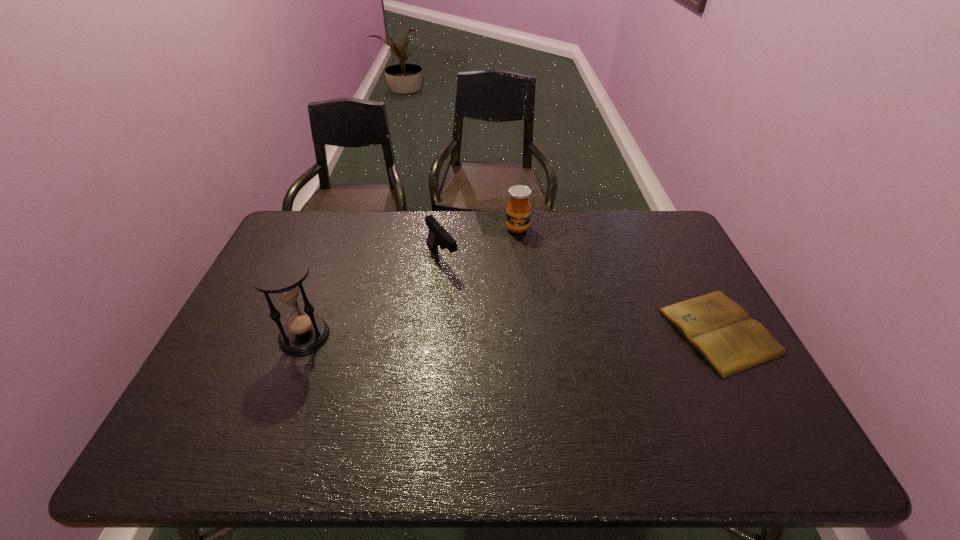
I want to click on empty location between the third object from left to right and the book, so click(x=618, y=280).

Identify the location of unoccupied area between the pistol and the book. The image size is (960, 540). (581, 294).

You are a GUI agent. You are given a task and a screenshot of the screen. Output one action in this format:
    pyautogui.click(x=<x>, y=<y>)
    Task: Click on the empty space between the tallest object and the third object from left to right
    
    Given the screenshot: What is the action you would take?
    pyautogui.click(x=411, y=282)

This screenshot has height=540, width=960. What are the coordinates of `free space that is in between the honey and the hourglass` in the screenshot? It's located at (411, 282).

The height and width of the screenshot is (540, 960). In order to click on vacant point located between the rightmost object and the third object from left to right in this screenshot , I will do `click(618, 280)`.

Locate which object is the third closest to the book. Please provide its 2D coordinates. Your answer should be formatted as a tuple, i.e. [(x, y)], where the tuple contains the x and y coordinates of a point satisfying the conditions above.

[(282, 275)]

Identify which object is located as the second nearest to the second farthest object. Please provide its 2D coordinates. Your answer should be formatted as a tuple, i.e. [(x, y)], where the tuple contains the x and y coordinates of a point satisfying the conditions above.

[(282, 275)]

Find the location of a particular element. The width and height of the screenshot is (960, 540). blank space that satisfies the following two spatial constraints: 1. on the front side of the second object from right to left; 2. on the left side of the book is located at coordinates (529, 330).

You are a GUI agent. You are given a task and a screenshot of the screen. Output one action in this format:
    pyautogui.click(x=<x>, y=<y>)
    Task: Click on the vacant region that satisfies the following two spatial constraints: 1. on the back side of the honey; 2. on the left side of the hourglass
    Image resolution: width=960 pixels, height=540 pixels.
    Given the screenshot: What is the action you would take?
    pyautogui.click(x=346, y=228)

The image size is (960, 540). Identify the location of vacant position in the image that satisfies the following two spatial constraints: 1. on the back side of the tallest object; 2. on the right side of the pistol. (334, 258).